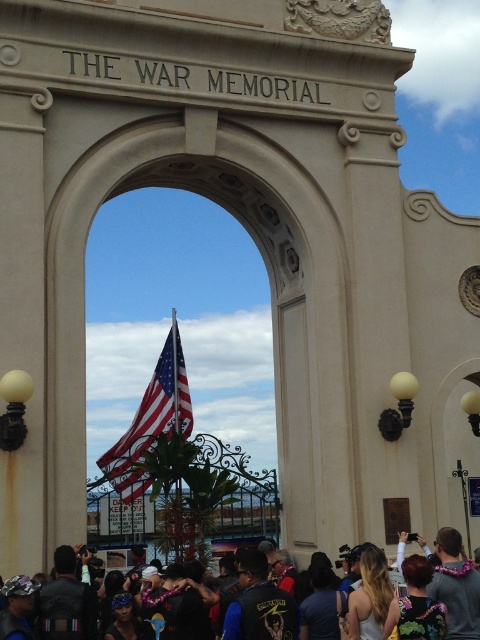
Does polished metallic flag at center appear over dark blue leather jacket at center?

Indeed, polished metallic flag at center is positioned over dark blue leather jacket at center.

Is polished metallic flag at center in front of dark blue leather jacket at center?

No, it is behind dark blue leather jacket at center.

Find the location of a particular element. The image size is (480, 640). polished metallic flag at center is located at coordinates (153, 413).

Find the location of a particular element. Image resolution: width=480 pixels, height=640 pixels. polished metallic flag at center is located at coordinates (153, 413).

Which of these two, polished metallic flag at center or blonde hair at center, stands shorter?

Standing shorter between the two is blonde hair at center.

Is polished metallic flag at center bigger than blonde hair at center?

Indeed, polished metallic flag at center has a larger size compared to blonde hair at center.

You are a GUI agent. You are given a task and a screenshot of the screen. Output one action in this format:
    pyautogui.click(x=<x>, y=<y>)
    Task: Click on the polished metallic flag at center
    This screenshot has height=640, width=480.
    Given the screenshot: What is the action you would take?
    pyautogui.click(x=153, y=413)

Describe the element at coordinates (66, 602) in the screenshot. This screenshot has width=480, height=640. I see `leather jacket at lower left` at that location.

Which of these two, leather jacket at lower left or dark blue shirt at center, stands shorter?

dark blue shirt at center is shorter.

Is point (40, 616) less distant than point (322, 586)?

Yes, it is.

Locate an element on the screen. leather jacket at lower left is located at coordinates point(66,602).